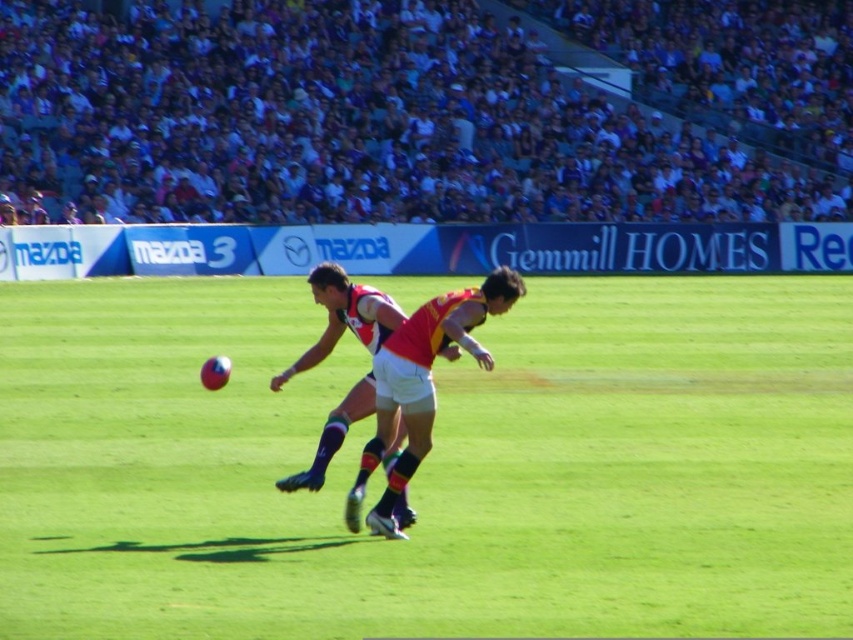
Question: Which is farther from the red jersey at center?

Choices:
 (A) red and white jersey at center
 (B) green grass field at center

Answer: (B)

Question: Estimate the real-world distances between objects in this image. Which object is farther from the red jersey at center?

Choices:
 (A) red and white jersey at center
 (B) green grass field at center

Answer: (B)

Question: Can you confirm if red jersey at center is smaller than red and white jersey at center?

Choices:
 (A) yes
 (B) no

Answer: (A)

Question: Does green grass field at center appear on the right side of red jersey at center?

Choices:
 (A) no
 (B) yes

Answer: (B)

Question: Estimate the real-world distances between objects in this image. Which object is farther from the red jersey at center?

Choices:
 (A) green grass field at center
 (B) red and white jersey at center

Answer: (A)

Question: Does green grass field at center have a greater width compared to red and white jersey at center?

Choices:
 (A) yes
 (B) no

Answer: (A)